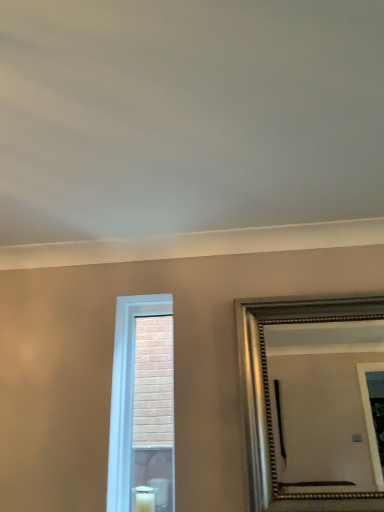
Question: Can you confirm if white wax candle at lower center is smaller than silver metallic mirror at right?

Choices:
 (A) yes
 (B) no

Answer: (A)

Question: Is white wax candle at lower center wider than silver metallic mirror at right?

Choices:
 (A) yes
 (B) no

Answer: (A)

Question: Is white wax candle at lower center completely or partially outside of silver metallic mirror at right?

Choices:
 (A) yes
 (B) no

Answer: (A)

Question: Is white wax candle at lower center looking in the opposite direction of silver metallic mirror at right?

Choices:
 (A) no
 (B) yes

Answer: (A)

Question: Would you say silver metallic mirror at right is part of white wax candle at lower center's contents?

Choices:
 (A) yes
 (B) no

Answer: (B)

Question: From their relative heights in the image, would you say white wax candle at lower center is taller or shorter than silver metallic mirror at right?

Choices:
 (A) short
 (B) tall

Answer: (A)

Question: Is white wax candle at lower center inside or outside of silver metallic mirror at right?

Choices:
 (A) outside
 (B) inside

Answer: (A)

Question: Based on their sizes in the image, would you say white wax candle at lower center is bigger or smaller than silver metallic mirror at right?

Choices:
 (A) small
 (B) big

Answer: (A)

Question: Based on their positions, is white wax candle at lower center located to the left or right of silver metallic mirror at right?

Choices:
 (A) left
 (B) right

Answer: (A)

Question: Considering the positions of point (152, 496) and point (110, 497), is point (152, 496) closer or farther from the camera than point (110, 497)?

Choices:
 (A) closer
 (B) farther

Answer: (B)

Question: Looking at their shapes, would you say white wax candle at lower center is wider or thinner than white glass window at center?

Choices:
 (A) thin
 (B) wide

Answer: (B)

Question: From a real-world perspective, relative to white glass window at center, is white wax candle at lower center vertically above or below?

Choices:
 (A) below
 (B) above

Answer: (A)

Question: Based on their positions, is white wax candle at lower center located to the left or right of white glass window at center?

Choices:
 (A) left
 (B) right

Answer: (B)

Question: From the image's perspective, is white glass window at center located above or below white wax candle at lower center?

Choices:
 (A) below
 (B) above

Answer: (B)

Question: Looking at their shapes, would you say white glass window at center is wider or thinner than white wax candle at lower center?

Choices:
 (A) wide
 (B) thin

Answer: (B)